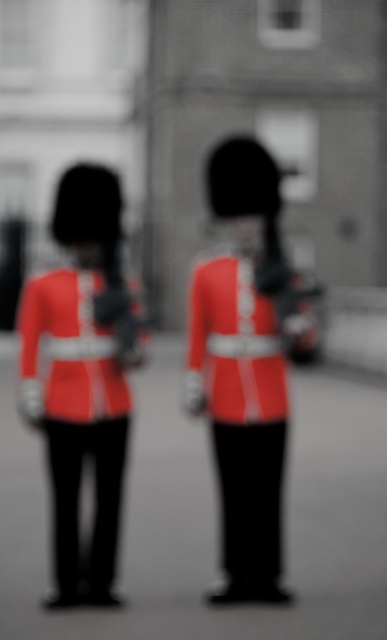
From the picture: You are a photographer trying to focus on the matte red uniform at center in a blurred image. The image has a coordinate system where the bottom left corner is the origin. The point given is at coordinates point (241, 412). Can you tell me where exactly the matte red uniform at center is located in terms of direction from the bottom left corner?

The point (241, 412) indicates the matte red uniform at center is located 64.5 percent to the right and 62.3 percent up from the bottom left corner of the image.

You are a photographer trying to capture a clear photo of the two guards in their uniforms. You notice that the matte red uniform at center and the matte red uniform at left are positioned in a way that might block each other. Which guard should you move to ensure both are fully visible in the photo?

The matte red uniform at left is behind the matte red uniform at center. To ensure both are fully visible, you should move the matte red uniform at left forward so it is no longer obstructed by the matte red uniform at center.

You are a photographer trying to capture two guards in their ceremonial uniforms. You notice the matte red uniform at center and the matte red uniform at left. Which uniform is positioned more to the left side of the image?

The matte red uniform at left is positioned more to the left side of the image.